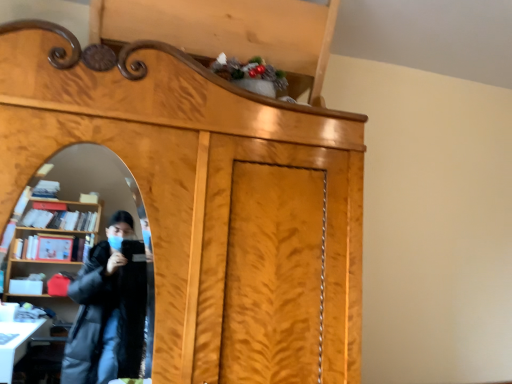
Question: Should I look upward or downward to see wooden cabinet at center?

Choices:
 (A) down
 (B) up

Answer: (A)